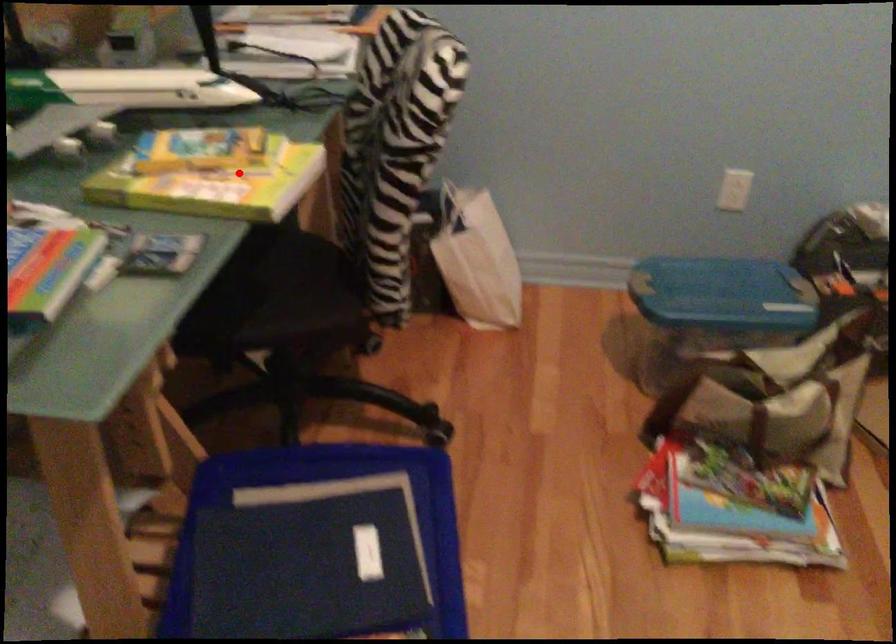
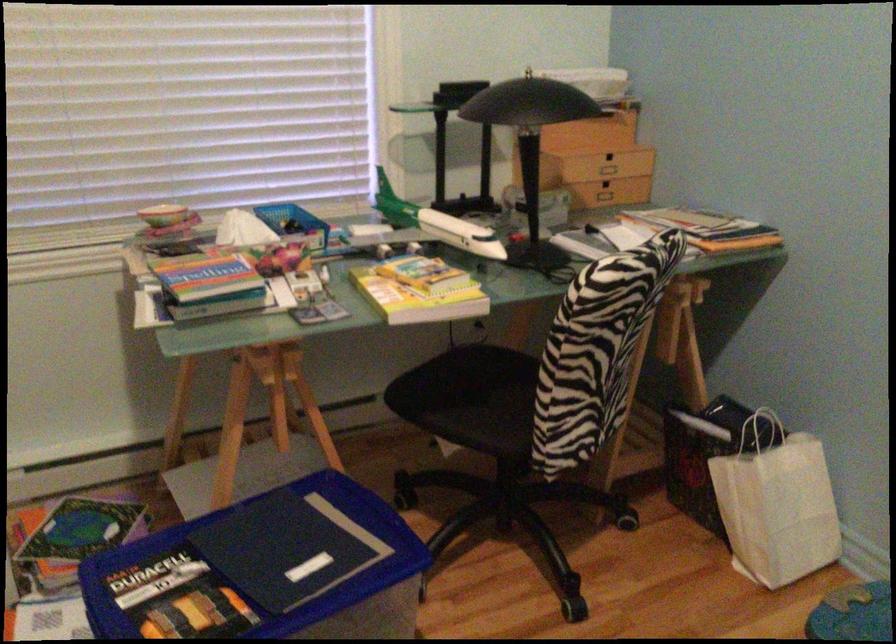
In the second image, find the point that corresponds to the highlighted location in the first image.

(419, 290)